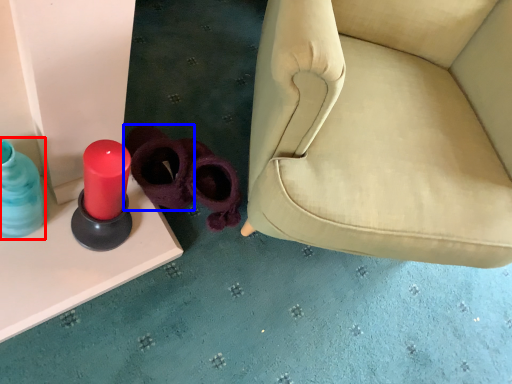
Question: Which of the following is the farthest to the observer, bottle (highlighted by a red box) or footwear (highlighted by a blue box)?

Choices:
 (A) bottle
 (B) footwear

Answer: (B)